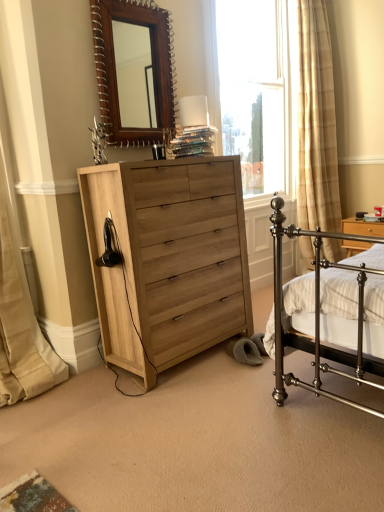
This screenshot has height=512, width=384. Identify the location of beige fabric curtain at left. (20, 320).

This screenshot has width=384, height=512. What do you see at coordinates (257, 91) in the screenshot?
I see `clear glass window at upper center` at bounding box center [257, 91].

What do you see at coordinates (152, 65) in the screenshot? I see `wooden mirror at upper center` at bounding box center [152, 65].

Identify the location of white glossy table lamp at upper center. (192, 130).

You are a GUI agent. You are given a task and a screenshot of the screen. Output one action in this format:
    pyautogui.click(x=<x>, y=<y>)
    Task: Click on the beige fabric curtain at left
    The image size is (384, 512).
    Given the screenshot: What is the action you would take?
    point(20,320)

Considering the relative sizes of wooden mirror at upper center and natural wood chest of drawers at center in the image provided, is wooden mirror at upper center wider than natural wood chest of drawers at center?

In fact, wooden mirror at upper center might be narrower than natural wood chest of drawers at center.

The height and width of the screenshot is (512, 384). Find the location of `mirror above the natural wood chest of drawers at center (from a real-world perspective)`. mirror above the natural wood chest of drawers at center (from a real-world perspective) is located at coordinates (152, 65).

Is wooden mirror at upper center looking in the opposite direction of natural wood chest of drawers at center?

No.

Who is bigger, wooden mirror at upper center or natural wood chest of drawers at center?

natural wood chest of drawers at center is bigger.

Does white glossy table lamp at upper center have a greater height compared to wooden nightstand at right?

Incorrect, the height of white glossy table lamp at upper center is not larger of that of wooden nightstand at right.

Is white glossy table lamp at upper center directly adjacent to wooden nightstand at right?

No, white glossy table lamp at upper center is not beside wooden nightstand at right.

From a real-world perspective, between white glossy table lamp at upper center and wooden nightstand at right, who is vertically higher?

white glossy table lamp at upper center, from a real-world perspective.

From the image's perspective, does white glossy table lamp at upper center appear lower than wooden nightstand at right?

No, from the image's perspective, white glossy table lamp at upper center is not beneath wooden nightstand at right.

Is wooden mirror at upper center located outside clear glass window at upper center?

Yes, wooden mirror at upper center is located beyond the bounds of clear glass window at upper center.

Looking at this image, how different are the orientations of wooden mirror at upper center and clear glass window at upper center in degrees?

There is a 0.143-degree angle between the facing directions of wooden mirror at upper center and clear glass window at upper center.

Does wooden mirror at upper center turn towards clear glass window at upper center?

No, wooden mirror at upper center is not facing towards clear glass window at upper center.

From a real-world perspective, is wooden mirror at upper center under clear glass window at upper center?

No, from a real-world perspective, wooden mirror at upper center is not beneath clear glass window at upper center.

Image resolution: width=384 pixels, height=512 pixels. Identify the location of window above the white glossy table lamp at upper center (from the image's perspective). (257, 91).

From a real-world perspective, which object rests below the other?

white glossy table lamp at upper center is physically lower.

Is clear glass window at upper center far from white glossy table lamp at upper center?

Yes, clear glass window at upper center and white glossy table lamp at upper center are located far from each other.

Is clear glass window at upper center taller than white glossy table lamp at upper center?

Correct, clear glass window at upper center is much taller as white glossy table lamp at upper center.

Considering the relative positions of wooden mirror at upper center and beige fabric curtain at left in the image provided, is wooden mirror at upper center to the left or to the right of beige fabric curtain at left?

wooden mirror at upper center is positioned on beige fabric curtain at left's right side.

Do you think wooden mirror at upper center is within beige fabric curtain at left, or outside of it?

wooden mirror at upper center is outside beige fabric curtain at left.

Considering the sizes of objects wooden mirror at upper center and beige fabric curtain at left in the image provided, who is taller, wooden mirror at upper center or beige fabric curtain at left?

Standing taller between the two is beige fabric curtain at left.

Are wooden mirror at upper center and wooden nightstand at right far apart?

Yes, wooden mirror at upper center and wooden nightstand at right are located far from each other.

The height and width of the screenshot is (512, 384). Identify the location of mirror lying on the left of wooden nightstand at right. (152, 65).

Which of these two, wooden mirror at upper center or wooden nightstand at right, is thinner?

wooden mirror at upper center.

Considering the positions of objects wooden mirror at upper center and wooden nightstand at right in the image provided, who is more to the right, wooden mirror at upper center or wooden nightstand at right?

wooden nightstand at right.

Is point (202, 346) farther from viewer compared to point (156, 32)?

No, it is in front of (156, 32).

Does natural wood chest of drawers at center contain wooden mirror at upper center?

No, wooden mirror at upper center is not a part of natural wood chest of drawers at center.

Which is behind, natural wood chest of drawers at center or wooden mirror at upper center?

wooden mirror at upper center.

The image size is (384, 512). I want to click on chest of drawers to the right of wooden mirror at upper center, so click(168, 258).

Image resolution: width=384 pixels, height=512 pixels. Find the location of `table lamp in front of the wooden nightstand at right`. table lamp in front of the wooden nightstand at right is located at coordinates (192, 130).

From the image, which object appears to be nearer to wooden mirror at upper center, wooden nightstand at right or clear glass window at upper center?

clear glass window at upper center is positioned closer to the anchor wooden mirror at upper center.

Which object lies further to the anchor point beige fabric curtain at left, clear glass window at upper center or wooden mirror at upper center?

Among the two, clear glass window at upper center is located further to beige fabric curtain at left.

Based on their spatial positions, is clear glass window at upper center or natural wood chest of drawers at center closer to beige fabric curtain at left?

The object closer to beige fabric curtain at left is natural wood chest of drawers at center.

From the image, which object appears to be nearer to white glossy table lamp at upper center, clear glass window at upper center or natural wood chest of drawers at center?

Based on the image, natural wood chest of drawers at center appears to be nearer to white glossy table lamp at upper center.

Estimate the real-world distances between objects in this image. Which object is further from wooden mirror at upper center, clear glass window at upper center or beige fabric curtain at left?

The object further to wooden mirror at upper center is clear glass window at upper center.

From the image, which object appears to be farther from beige fabric curtain at left, wooden mirror at upper center or natural wood chest of drawers at center?

wooden mirror at upper center is further to beige fabric curtain at left.

When comparing their distances from wooden mirror at upper center, does natural wood chest of drawers at center or clear glass window at upper center seem further?

The object further to wooden mirror at upper center is clear glass window at upper center.

Considering their positions, is white glossy table lamp at upper center positioned further to beige fabric curtain at left than wooden nightstand at right?

Based on the image, wooden nightstand at right appears to be further to beige fabric curtain at left.

What are the coordinates of `window situated between wooden mirror at upper center and wooden nightstand at right from left to right` in the screenshot? It's located at (257, 91).

At what (x,y) coordinates should I click in order to perform the action: click on table lamp between beige fabric curtain at left and clear glass window at upper center in the horizontal direction. Please return your answer as a coordinate pair (x, y). The width and height of the screenshot is (384, 512). Looking at the image, I should click on (192, 130).

The image size is (384, 512). What are the coordinates of `table lamp between natural wood chest of drawers at center and wooden nightstand at right` in the screenshot? It's located at (192, 130).

Locate an element on the screen. Image resolution: width=384 pixels, height=512 pixels. table lamp between wooden mirror at upper center and natural wood chest of drawers at center in the vertical direction is located at coordinates (192, 130).